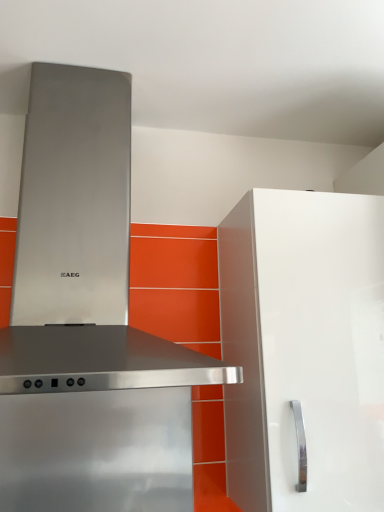
Image resolution: width=384 pixels, height=512 pixels. What do you see at coordinates (304, 348) in the screenshot? I see `white glossy cabinet at right` at bounding box center [304, 348].

You are a GUI agent. You are given a task and a screenshot of the screen. Output one action in this format:
    pyautogui.click(x=<x>, y=<y>)
    Task: Click on the white glossy cabinet at right
    
    Given the screenshot: What is the action you would take?
    pyautogui.click(x=304, y=348)

Find the location of a particular element. The image size is (384, 512). stainless steel range hood at upper left is located at coordinates (87, 320).

Consider the image. Measure the distance between point (156, 423) and camera.

The depth of point (156, 423) is 3.53 feet.

Image resolution: width=384 pixels, height=512 pixels. What do you see at coordinates (87, 320) in the screenshot?
I see `stainless steel range hood at upper left` at bounding box center [87, 320].

The height and width of the screenshot is (512, 384). What are the coordinates of `white glossy cabinet at right` in the screenshot? It's located at (304, 348).

From the picture: Does white glossy cabinet at right appear on the left side of stainless steel range hood at upper left?

No, white glossy cabinet at right is not to the left of stainless steel range hood at upper left.

Does white glossy cabinet at right lie behind stainless steel range hood at upper left?

That is True.

Does point (249, 488) come closer to viewer compared to point (134, 479)?

Yes, point (249, 488) is in front of point (134, 479).

From the image's perspective, is white glossy cabinet at right located beneath stainless steel range hood at upper left?

Yes, from the image's perspective, white glossy cabinet at right is below stainless steel range hood at upper left.

From a real-world perspective, is white glossy cabinet at right on top of stainless steel range hood at upper left?

Incorrect, from a real-world perspective, white glossy cabinet at right is lower than stainless steel range hood at upper left.

Can you confirm if white glossy cabinet at right is thinner than stainless steel range hood at upper left?

Yes, white glossy cabinet at right is thinner than stainless steel range hood at upper left.

Who is shorter, white glossy cabinet at right or stainless steel range hood at upper left?

Standing shorter between the two is white glossy cabinet at right.

Can you confirm if white glossy cabinet at right is smaller than stainless steel range hood at upper left?

Indeed, white glossy cabinet at right has a smaller size compared to stainless steel range hood at upper left.

Is stainless steel range hood at upper left a part of white glossy cabinet at right?

That's incorrect, stainless steel range hood at upper left is not inside white glossy cabinet at right.

Is white glossy cabinet at right far away from stainless steel range hood at upper left?

white glossy cabinet at right is near stainless steel range hood at upper left, not far away.

Could you tell me if white glossy cabinet at right is turned towards stainless steel range hood at upper left?

No, white glossy cabinet at right is not turned towards stainless steel range hood at upper left.

Can you tell me how much white glossy cabinet at right and stainless steel range hood at upper left differ in facing direction?

white glossy cabinet at right and stainless steel range hood at upper left are facing 0.000808 degrees away from each other.

The width and height of the screenshot is (384, 512). I want to click on home appliance on the left of white glossy cabinet at right, so click(87, 320).

Visually, is stainless steel range hood at upper left positioned to the left or to the right of white glossy cabinet at right?

In the image, stainless steel range hood at upper left appears on the left side of white glossy cabinet at right.

Is stainless steel range hood at upper left in front of or behind white glossy cabinet at right in the image?

Clearly, stainless steel range hood at upper left is in front of white glossy cabinet at right.

Which is in front, point (11, 500) or point (355, 305)?

Positioned in front is point (355, 305).

From the image's perspective, which is above, stainless steel range hood at upper left or white glossy cabinet at right?

stainless steel range hood at upper left is shown above in the image.

From a real-world perspective, which object rests below the other?

From a 3D spatial view, white glossy cabinet at right is below.

In the scene shown: Is stainless steel range hood at upper left wider or thinner than white glossy cabinet at right?

In the image, stainless steel range hood at upper left appears to be wider than white glossy cabinet at right.

Who is shorter, stainless steel range hood at upper left or white glossy cabinet at right?

Standing shorter between the two is white glossy cabinet at right.

Is stainless steel range hood at upper left bigger or smaller than white glossy cabinet at right?

stainless steel range hood at upper left is bigger than white glossy cabinet at right.

Is stainless steel range hood at upper left positioned beyond the bounds of white glossy cabinet at right?

That's correct, stainless steel range hood at upper left is outside of white glossy cabinet at right.

Are stainless steel range hood at upper left and white glossy cabinet at right making contact?

No, stainless steel range hood at upper left is not making contact with white glossy cabinet at right.

Is stainless steel range hood at upper left facing towards white glossy cabinet at right?

No, stainless steel range hood at upper left is not aimed at white glossy cabinet at right.

How many degrees apart are the facing directions of stainless steel range hood at upper left and white glossy cabinet at right?

They differ by 0.000808 degrees in their facing directions.

Locate an element on the screen. The height and width of the screenshot is (512, 384). home appliance that is above the white glossy cabinet at right (from a real-world perspective) is located at coordinates (87, 320).

Identify the location of home appliance in front of the white glossy cabinet at right. (87, 320).

Locate an element on the screen. This screenshot has height=512, width=384. cabinetry that appears on the right of stainless steel range hood at upper left is located at coordinates point(304,348).